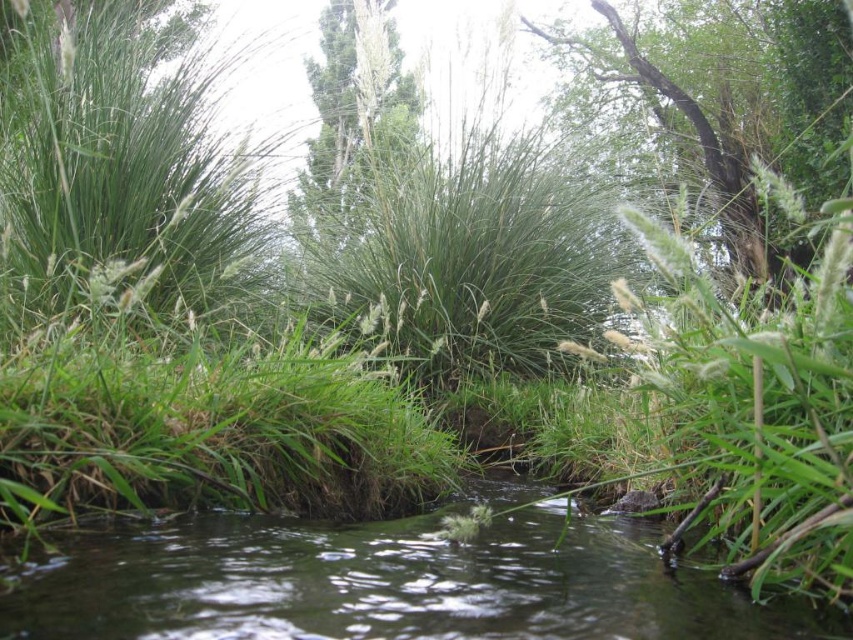
Question: Does green grassy river at center appear under green grassy plant at upper center?

Choices:
 (A) no
 (B) yes

Answer: (B)

Question: Can you confirm if green grassy plant at upper center is positioned above green rough bark tree at upper center?

Choices:
 (A) yes
 (B) no

Answer: (A)

Question: Which point appears farthest from the camera in this image?

Choices:
 (A) (689, 112)
 (B) (375, 566)

Answer: (A)

Question: Which point is farther from the camera taking this photo?

Choices:
 (A) (764, 266)
 (B) (352, 51)
 (C) (393, 608)

Answer: (B)

Question: In this image, where is green grassy plant at upper center located relative to green rough bark tree at upper center?

Choices:
 (A) above
 (B) below

Answer: (A)

Question: Among these objects, which one is farthest from the camera?

Choices:
 (A) green grassy plant at upper center
 (B) green rough bark tree at upper center

Answer: (B)